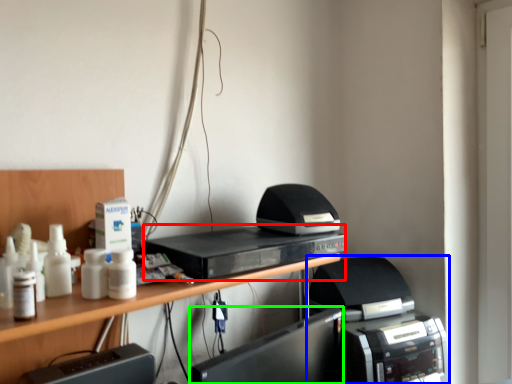
Question: Which object is the farthest from home appliance (highlighted by a red box)? Choose among these: printer (highlighted by a blue box) or register (highlighted by a green box).

Choices:
 (A) printer
 (B) register

Answer: (A)